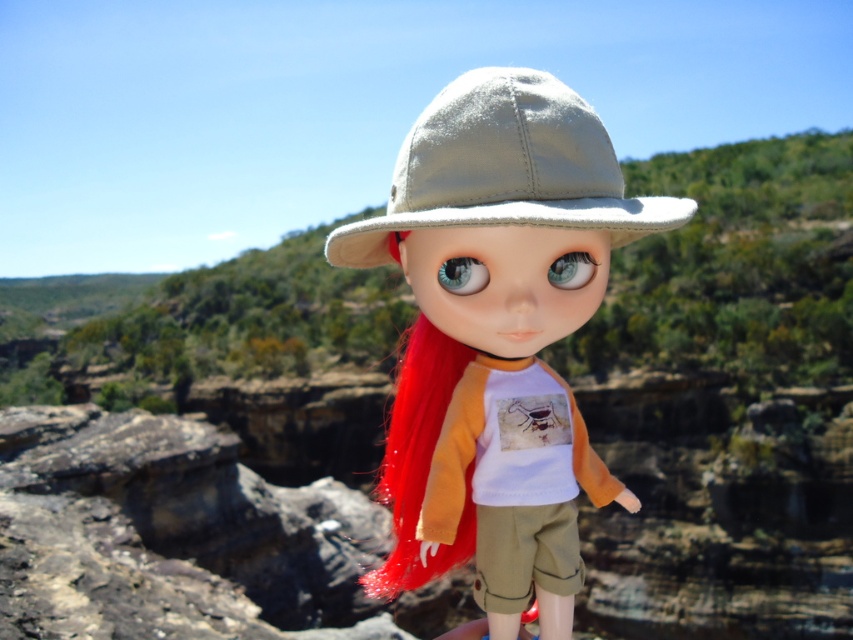
Question: Which of the following is the farthest from the observer?

Choices:
 (A) satin beige hat at center
 (B) satin beige fedora at center

Answer: (B)

Question: Which point is farther to the camera?

Choices:
 (A) satin beige fedora at center
 (B) satin beige hat at center

Answer: (A)

Question: Does satin beige hat at center have a larger size compared to satin beige fedora at center?

Choices:
 (A) no
 (B) yes

Answer: (B)

Question: Considering the relative positions of satin beige hat at center and satin beige fedora at center in the image provided, where is satin beige hat at center located with respect to satin beige fedora at center?

Choices:
 (A) below
 (B) above

Answer: (A)

Question: Is satin beige hat at center bigger than satin beige fedora at center?

Choices:
 (A) yes
 (B) no

Answer: (A)

Question: Among these objects, which one is farthest from the camera?

Choices:
 (A) satin beige fedora at center
 (B) satin beige hat at center

Answer: (A)